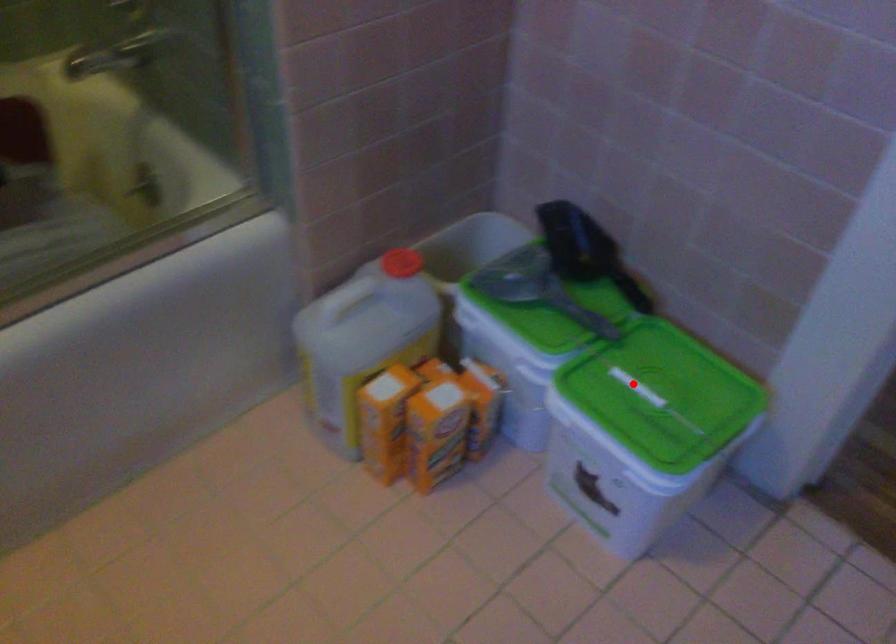
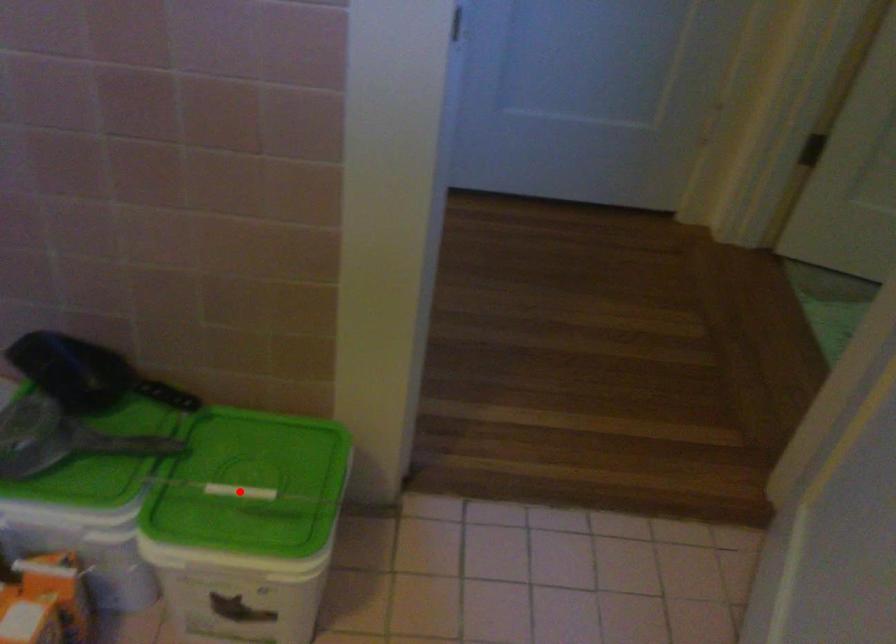
I am providing you with two images of the same scene from different viewpoints. A red point is marked on the first image and another point is marked on the second image. Is the red point in image1 aligned with the point shown in image2?

Yes